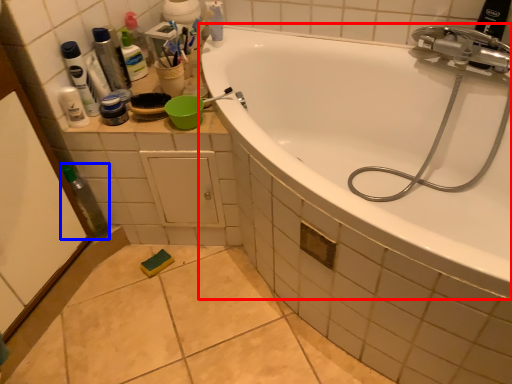
Question: Which object is closer to the camera taking this photo, bathtub (highlighted by a red box) or bottle (highlighted by a blue box)?

Choices:
 (A) bathtub
 (B) bottle

Answer: (A)